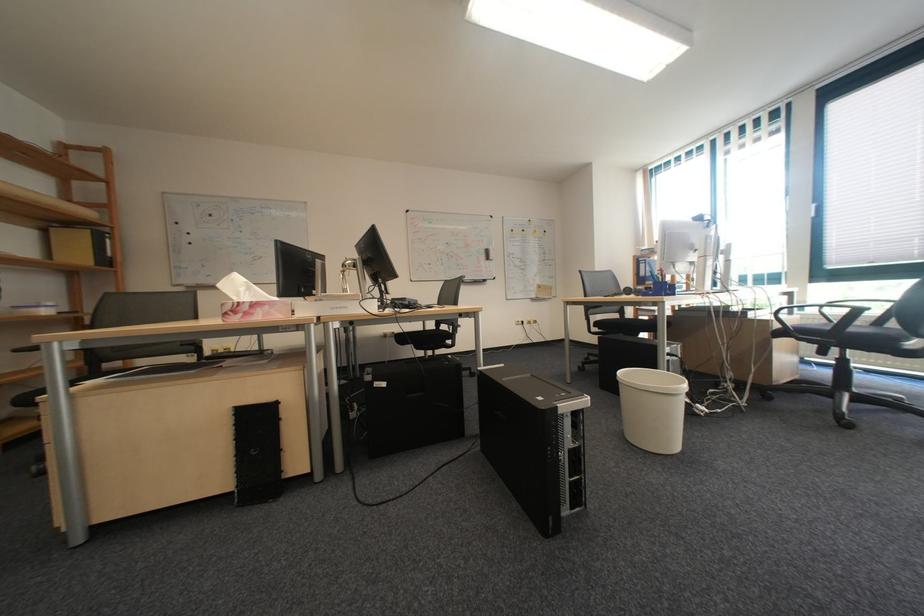
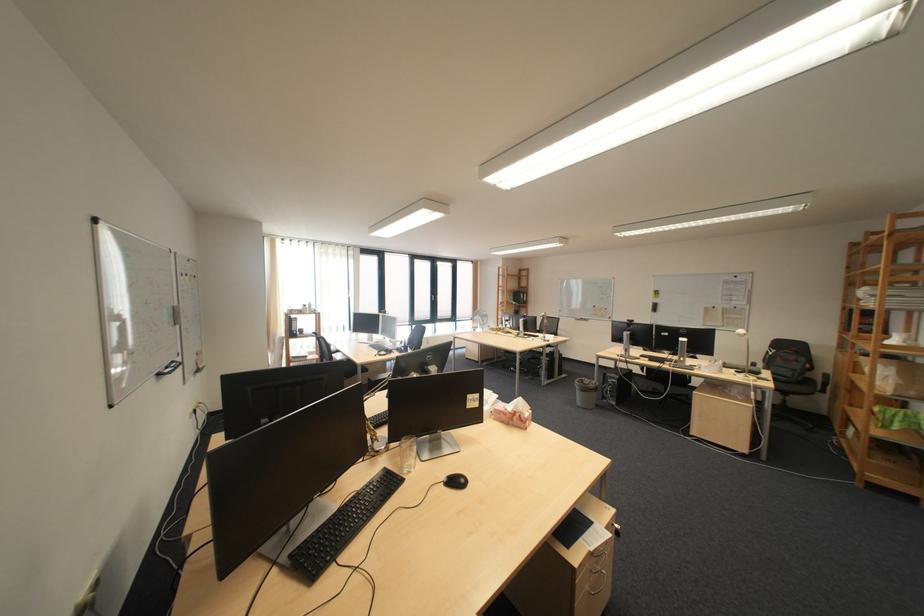
Question: I am providing you with two images of the same scene from different viewpoints. Which of the following objects are not visible in image2?

Choices:
 (A) clear drinking glass
 (B) cabinet door latch
 (C) black keyboard
 (D) chair sitting surface

Answer: (D)